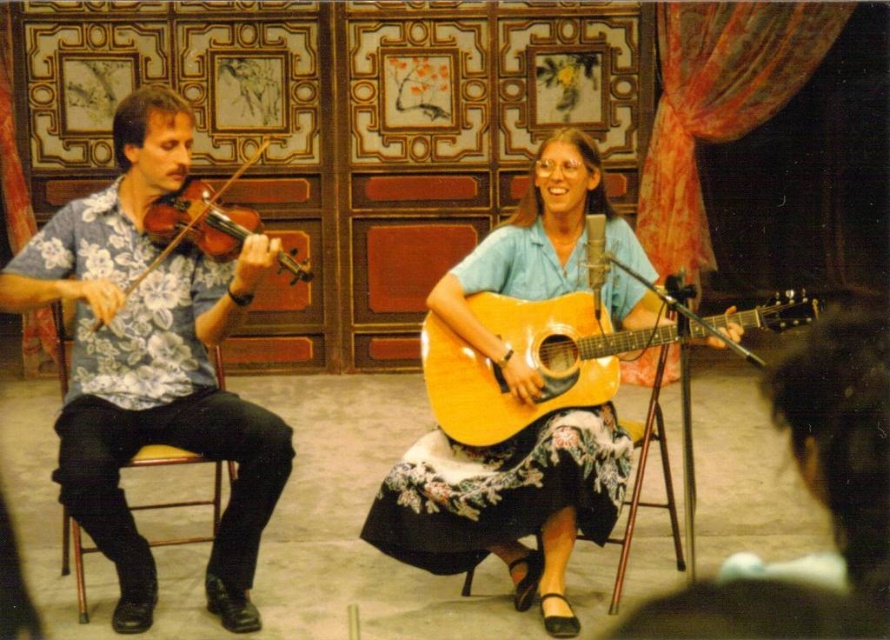
Question: Which point is farther from the camera taking this photo?

Choices:
 (A) [605, 310]
 (B) [312, 276]
 (C) [642, 465]
 (D) [66, 516]

Answer: (D)

Question: Which point appears farthest from the camera in this image?

Choices:
 (A) (222, 253)
 (B) (684, 381)

Answer: (A)

Question: Can you confirm if glossy wood guitar at center is wider than wooden violin at left?

Choices:
 (A) no
 (B) yes

Answer: (B)

Question: Which of the following is the closest to the observer?

Choices:
 (A) (69, 442)
 (B) (205, 244)
 (C) (462, 419)

Answer: (A)

Question: Is glossy wood guitar at center to the right of yellow wood chair at left from the viewer's perspective?

Choices:
 (A) no
 (B) yes

Answer: (B)

Question: Can you confirm if glossy wood guitar at center is thinner than wooden chair at center?

Choices:
 (A) no
 (B) yes

Answer: (A)